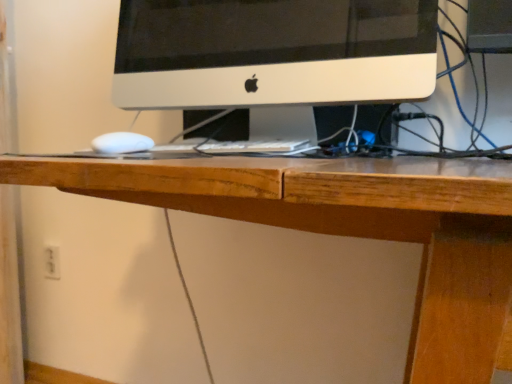
Question: Choose the correct answer: Is white plastic electric outlet at lower left inside white matte computer monitor at center or outside it?

Choices:
 (A) outside
 (B) inside

Answer: (A)

Question: From the image's perspective, relative to white matte computer monitor at center, is white plastic electric outlet at lower left above or below?

Choices:
 (A) above
 (B) below

Answer: (B)

Question: In terms of width, does white plastic electric outlet at lower left look wider or thinner when compared to white matte computer monitor at center?

Choices:
 (A) thin
 (B) wide

Answer: (A)

Question: From the image's perspective, relative to white plastic electric outlet at lower left, is white matte computer monitor at center above or below?

Choices:
 (A) below
 (B) above

Answer: (B)

Question: Would you say white matte computer monitor at center is to the left or to the right of white plastic electric outlet at lower left in the picture?

Choices:
 (A) left
 (B) right

Answer: (B)

Question: Considering their positions, is white matte computer monitor at center located in front of or behind white plastic electric outlet at lower left?

Choices:
 (A) behind
 (B) front

Answer: (B)

Question: Is point (183, 59) positioned closer to the camera than point (50, 264)?

Choices:
 (A) farther
 (B) closer

Answer: (B)